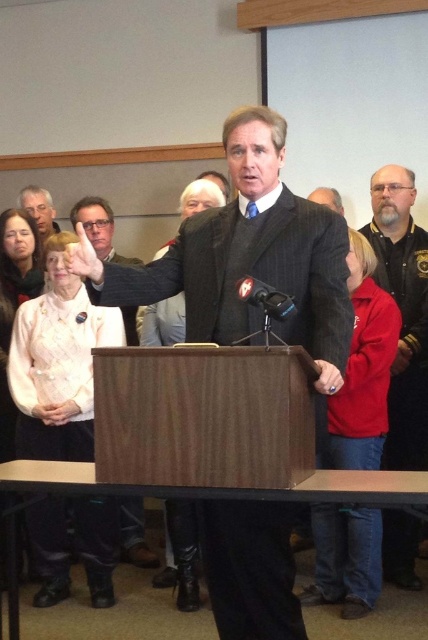
Is the position of dark gray pinstripe suit at center less distant than that of matte black suit at upper center?

Yes.

In the scene shown: Who is more forward, (281, 276) or (127, 547)?

Point (281, 276) is in front.

Where is `dark gray pinstripe suit at center`? dark gray pinstripe suit at center is located at coordinates pos(247,257).

Who is positioned more to the left, dark brown leather jacket at right or matte black suit at upper center?

Positioned to the left is matte black suit at upper center.

Is point (404, 586) more distant than point (115, 256)?

That is False.

Looking at this image, who is more distant from viewer, (425, 426) or (140, 531)?

The point (140, 531) is more distant.

The width and height of the screenshot is (428, 640). Find the location of `dark brown leather jacket at right`. dark brown leather jacket at right is located at coordinates (403, 310).

Can you confirm if matte gray suit at upper left is positioned to the right of matte black suit at center?

Incorrect, matte gray suit at upper left is not on the right side of matte black suit at center.

Between matte gray suit at upper left and matte black suit at center, which one is positioned higher?

Positioned higher is matte black suit at center.

Who is more forward, (35, 189) or (332, 198)?

Point (332, 198) is in front.

The height and width of the screenshot is (640, 428). I want to click on matte gray suit at upper left, so pos(38,209).